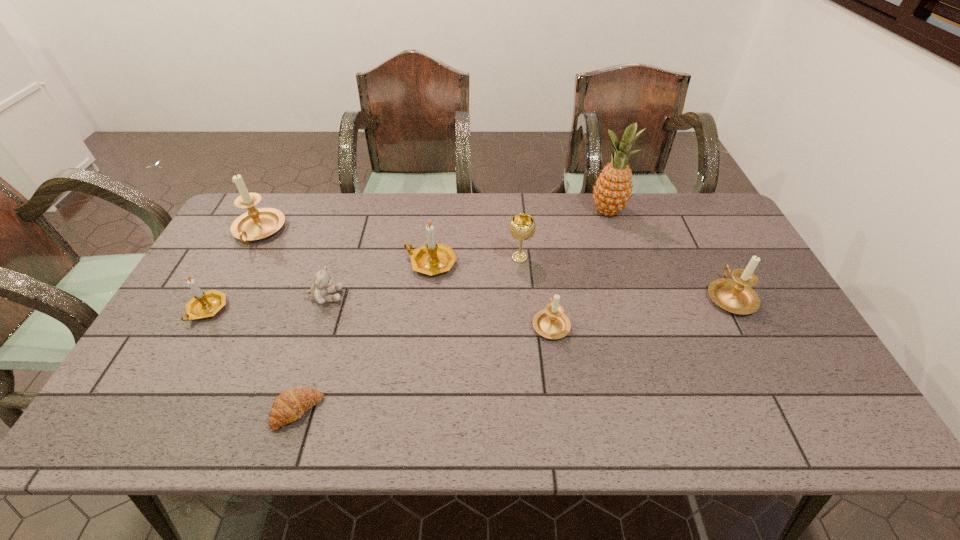
Where is `vacant space situated with a handle on the side of the rightmost beige candle holder`? The image size is (960, 540). vacant space situated with a handle on the side of the rightmost beige candle holder is located at coordinates (687, 215).

You are a GUI agent. You are given a task and a screenshot of the screen. Output one action in this format:
    pyautogui.click(x=<x>, y=<y>)
    Task: Click on the free space located 0.050m with a handle on the side of the rightmost beige candle holder
    The width and height of the screenshot is (960, 540).
    Given the screenshot: What is the action you would take?
    pyautogui.click(x=713, y=264)

You are a GUI agent. You are given a task and a screenshot of the screen. Output one action in this format:
    pyautogui.click(x=<x>, y=<y>)
    Task: Click on the vacant space located 0.330m on the right of the third candle holder from left to right
    The image size is (960, 540).
    Given the screenshot: What is the action you would take?
    pyautogui.click(x=566, y=263)

In order to click on free space located on the back of the chalice in this screenshot , I will do `click(515, 198)`.

I want to click on vacant space located 0.350m with a handle on the side of the smallest beige candle holder, so click(x=538, y=226).

Locate an element on the screen. This screenshot has height=540, width=960. blank space located 0.220m with a handle on the side of the smallest beige candle holder is located at coordinates (540, 253).

Locate an element on the screen. The height and width of the screenshot is (540, 960). vacant area situated 0.380m with a handle on the side of the smallest beige candle holder is located at coordinates (537, 220).

Image resolution: width=960 pixels, height=540 pixels. In order to click on vacant space located on the back of the nearer gold candle holder in this screenshot , I will do `click(258, 218)`.

Where is `vacant space located 0.160m on the face of the teddy bear`? vacant space located 0.160m on the face of the teddy bear is located at coordinates (400, 296).

The width and height of the screenshot is (960, 540). What are the coordinates of `vacant space located 0.110m on the back of the nearest object` in the screenshot? It's located at (316, 352).